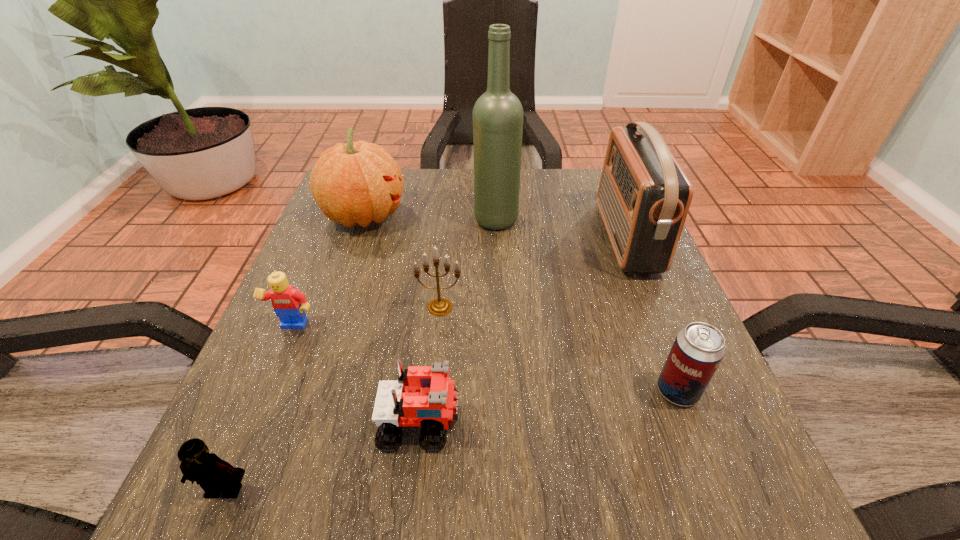
I want to click on free space between the rightmost Lego and the nearest Lego, so click(323, 456).

This screenshot has height=540, width=960. Identify the location of vacant area that lies between the nearest Lego and the sixth object from left to right. (360, 354).

Image resolution: width=960 pixels, height=540 pixels. In order to click on vacant space in between the nearest object and the radio receiver in this screenshot , I will do `click(425, 363)`.

Image resolution: width=960 pixels, height=540 pixels. Find the location of `object that ranks as the seventh closest to the wine bottle`. object that ranks as the seventh closest to the wine bottle is located at coordinates (215, 476).

Identify which object is the seventh nearest to the radio receiver. Please provide its 2D coordinates. Your answer should be formatted as a tuple, i.e. [(x, y)], where the tuple contains the x and y coordinates of a point satisfying the conditions above.

[(215, 476)]

Choose which Lego is the nearest neighbor to the rightmost Lego. Please provide its 2D coordinates. Your answer should be formatted as a tuple, i.e. [(x, y)], where the tuple contains the x and y coordinates of a point satisfying the conditions above.

[(215, 476)]

Find the location of a particular element. The width and height of the screenshot is (960, 540). the second closest Lego to the second farthest Lego is located at coordinates (288, 303).

You are a GUI agent. You are given a task and a screenshot of the screen. Output one action in this format:
    pyautogui.click(x=<x>, y=<y>)
    Task: Click on the free space that satisfies the following two spatial constraints: 1. on the front-facing side of the rightmost Lego; 2. on the face of the nearest Lego
    
    Given the screenshot: What is the action you would take?
    pyautogui.click(x=413, y=489)

In order to click on vacant position in the image that satisfies the following two spatial constraints: 1. on the carved face of the sixth shortest object; 2. on the right side of the sixth object from left to right in this screenshot , I will do `click(363, 219)`.

At what (x,y) coordinates should I click in order to perform the action: click on free point that satisfies the following two spatial constraints: 1. on the carved face of the sixth shortest object; 2. on the face of the fifth farthest object. Please return your answer as a coordinate pair (x, y). Looking at the image, I should click on (325, 328).